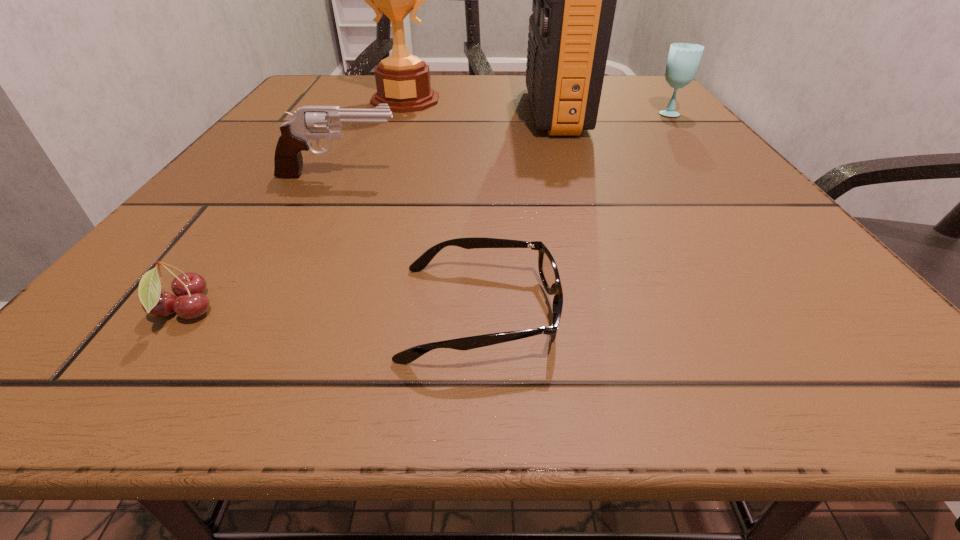
The height and width of the screenshot is (540, 960). What are the coordinates of `object that is the second nearest to the award` in the screenshot? It's located at (308, 122).

Locate an element on the screen. Image resolution: width=960 pixels, height=540 pixels. object that stands as the fifth closest to the radio receiver is located at coordinates (190, 303).

This screenshot has width=960, height=540. Identify the location of vacant position in the image that satisfies the following two spatial constraints: 1. on the front-facing side of the award; 2. at the muzzle of the gun. (378, 176).

You are a GUI agent. You are given a task and a screenshot of the screen. Output one action in this format:
    pyautogui.click(x=<x>, y=<y>)
    Task: Click on the vacant position in the image that satisfies the following two spatial constraints: 1. on the front-facing side of the rightmost object; 2. on the left side of the award
    The image size is (960, 540).
    Given the screenshot: What is the action you would take?
    pyautogui.click(x=401, y=113)